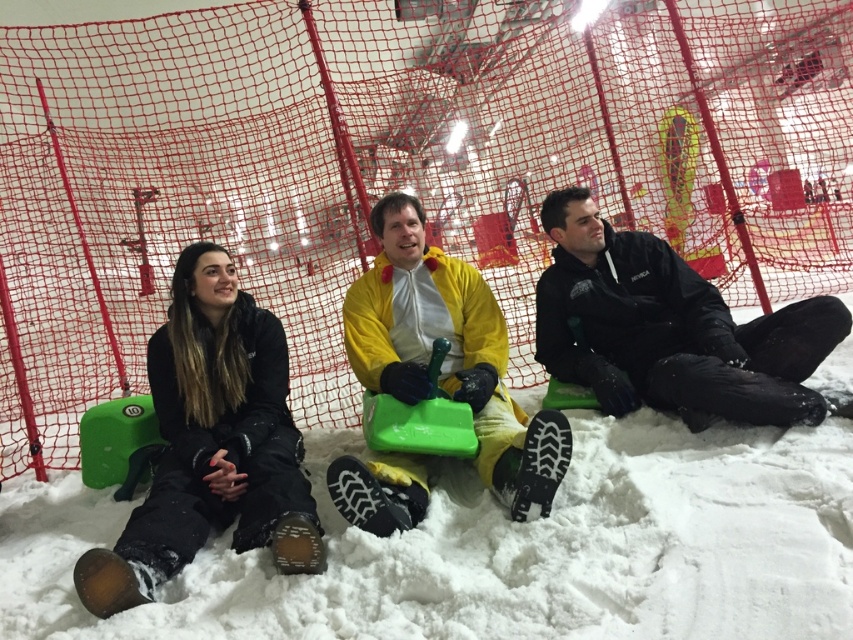
You are a photographer trying to capture a group photo of the black matte snow pants at left and the yellow matte snowsuit at center. Since you want to ensure both subjects are in focus, you need to know their relative positions. Based on the scene, which of the two is closer to the camera?

The black matte snow pants at left is in front of the yellow matte snowsuit at center, so it is closer to the camera.